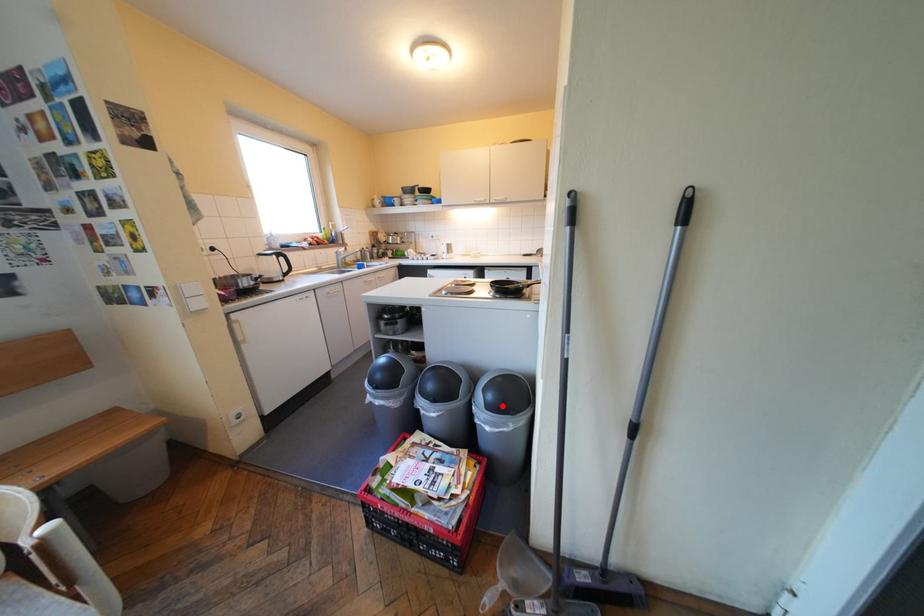
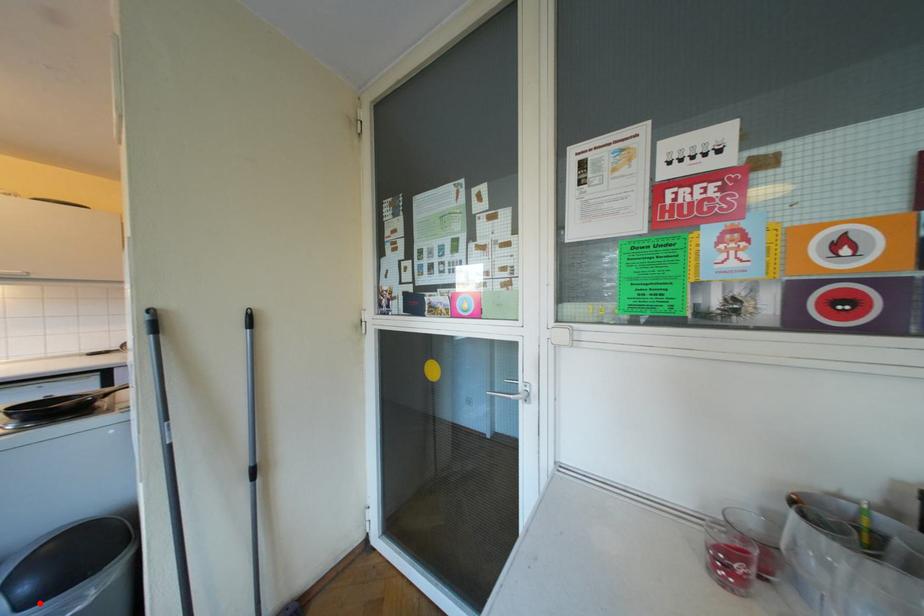
I am providing you with two images of the same scene from different viewpoints. A red point is marked on the first image and another point is marked on the second image. Do the highlighted points in image1 and image2 indicate the same real-world spot?

Yes